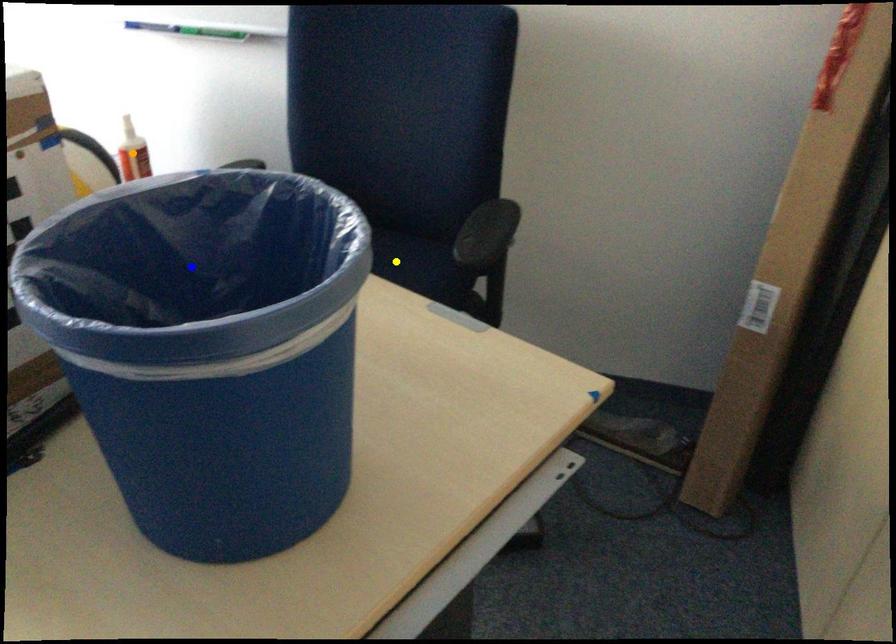
Order these from nearest to farthest:
A) blue point
B) yellow point
C) orange point

blue point < orange point < yellow point